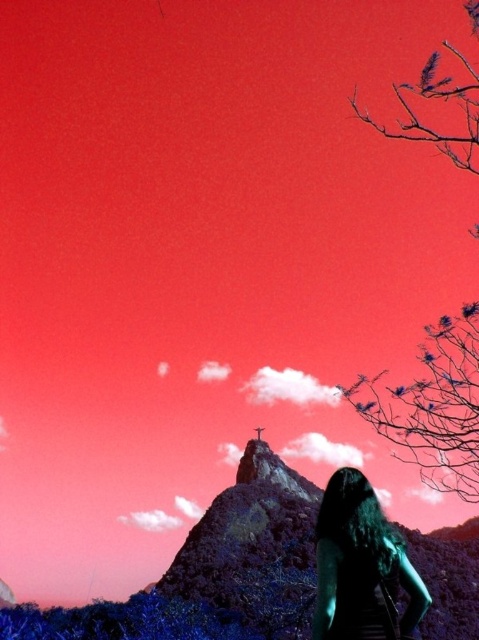
Question: Does smooth bark tree at right appear on the right side of green matte hair at lower right?

Choices:
 (A) yes
 (B) no

Answer: (A)

Question: Which point appears closest to the camera in this image?

Choices:
 (A) (340, 556)
 (B) (435, 474)

Answer: (A)

Question: Which object is closer to the camera taking this photo?

Choices:
 (A) smooth bark tree at right
 (B) green matte hair at lower right

Answer: (B)

Question: Does smooth bark tree at right have a lesser width compared to green matte hair at lower right?

Choices:
 (A) no
 (B) yes

Answer: (A)

Question: Does smooth bark tree at right have a smaller size compared to green matte hair at lower right?

Choices:
 (A) yes
 (B) no

Answer: (B)